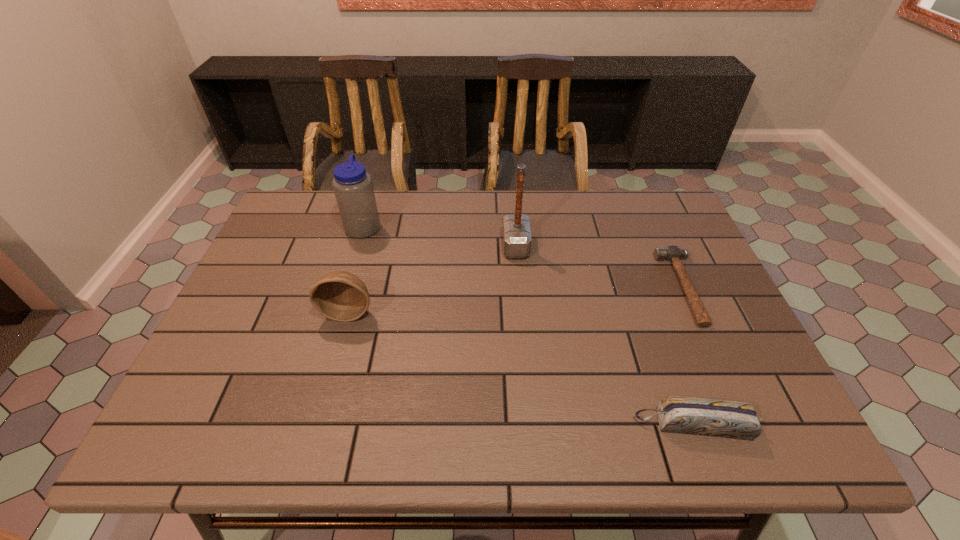
In order to click on pencil box located at the right edge in this screenshot , I will do `click(730, 419)`.

Locate an element on the screen. hammer at the right edge is located at coordinates (672, 253).

This screenshot has width=960, height=540. What are the coordinates of `object present at the near right corner` in the screenshot? It's located at (730, 419).

Locate an element on the screen. vacant space at the far edge is located at coordinates (444, 235).

In the image, there is a desktop. Where is `vacant space at the near edge`? The height and width of the screenshot is (540, 960). vacant space at the near edge is located at coordinates (383, 416).

What are the coordinates of `vacant space at the left edge of the desktop` in the screenshot? It's located at (225, 361).

At what (x,y) coordinates should I click in order to perform the action: click on vacant space at the right edge of the desktop. Please return your answer as a coordinate pair (x, y). Looking at the image, I should click on (697, 276).

The image size is (960, 540). What are the coordinates of `blank space at the far right corner` in the screenshot? It's located at (660, 219).

Find the location of a particular element. The height and width of the screenshot is (540, 960). vacant space in between the shorter hammer and the fourth tallest object is located at coordinates (688, 356).

Find the location of a particular element. empty location between the pencil box and the bowl is located at coordinates [521, 368].